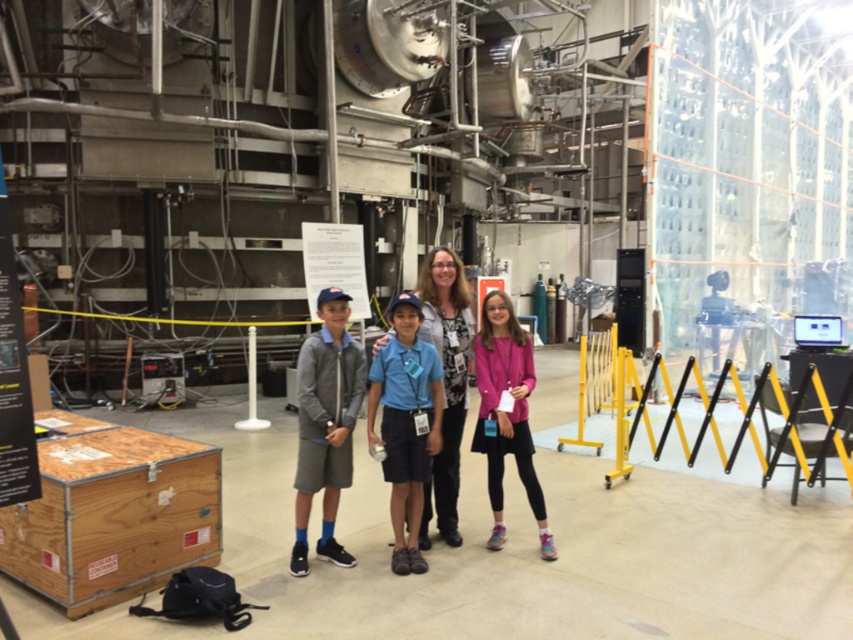
You are a photographer standing in front of the group. You want to capture a photo where the pink fabric jacket at center is visible above the matte gray sweater at center. Is this possible with your current position?

The pink fabric jacket at center is currently below the matte gray sweater at center, so adjusting your angle or position might be necessary to ensure the pink fabric jacket at center appears above the matte gray sweater at center in the photo.

You are a photographer trying to capture a group photo of the four individuals in the scene. You notice the pink fabric jacket at center and the matte gray sweater at center. Which clothing item would you adjust to ensure both are visible in the frame?

The pink fabric jacket at center is narrower than the matte gray sweater at center, so you should adjust the matte gray sweater at center to ensure both are visible in the frame.

You are a tour guide in the facility and need to ensure that all visitors maintain a minimum distance of 36 inches for safety. Are the gray cotton shorts at center and pink fabric jacket at center meeting this requirement?

The distance between the gray cotton shorts at center and the pink fabric jacket at center is 36.02 inches, which exceeds the required 36 inches, so they are maintaining the minimum distance.